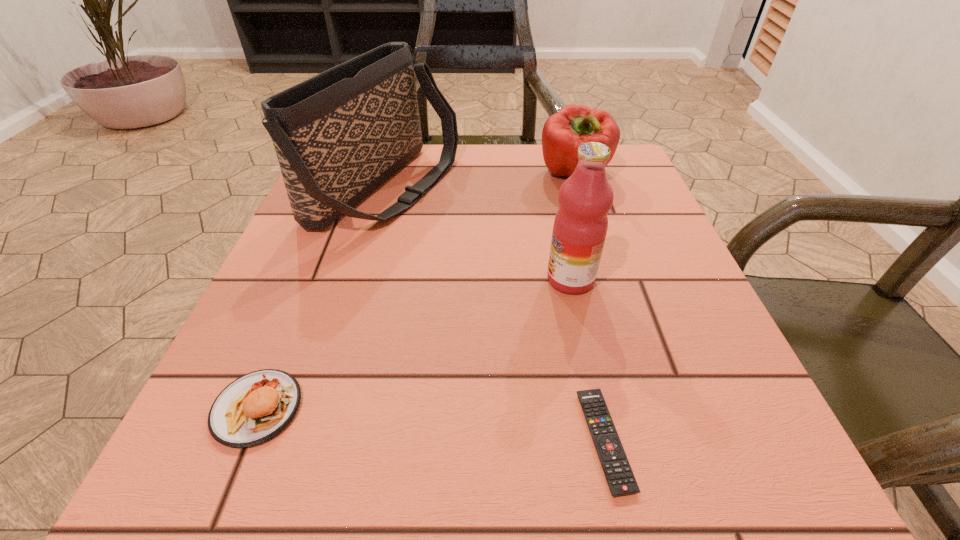
At what (x,y) coordinates should I click in order to perform the action: click on handbag. Please return your answer as a coordinate pair (x, y). This screenshot has width=960, height=540. Looking at the image, I should click on (338, 135).

Where is `fruit juice`? fruit juice is located at coordinates (580, 226).

The image size is (960, 540). I want to click on the third shortest object, so click(563, 132).

This screenshot has width=960, height=540. Find the location of `patty`. patty is located at coordinates (255, 407).

Identify the location of remote control. This screenshot has height=540, width=960. pos(618,473).

This screenshot has width=960, height=540. Find the location of `free space located on the front of the handbag`. free space located on the front of the handbag is located at coordinates (334, 367).

At what (x,y) coordinates should I click in order to perform the action: click on free region located 0.150m on the label of the fruit juice. Please return your answer as a coordinate pair (x, y). Looking at the image, I should click on point(459,279).

Find the location of a particular element. The width and height of the screenshot is (960, 540). vacant space located on the label of the fruit juice is located at coordinates (324, 279).

You are a GUI agent. You are given a task and a screenshot of the screen. Output one action in this format:
    pyautogui.click(x=<x>, y=<y>)
    Task: Click on the vacant space located on the label of the fruit juice
    The width and height of the screenshot is (960, 540).
    Given the screenshot: What is the action you would take?
    pyautogui.click(x=453, y=279)

Where is `vacant space situated on the front of the bell pepper`? vacant space situated on the front of the bell pepper is located at coordinates (621, 328).